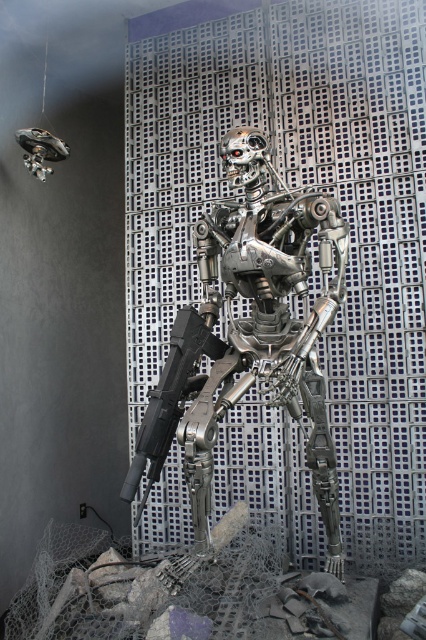
Question: Observing the image, what is the correct spatial positioning of metallic robot at center in reference to black matte gun at center?

Choices:
 (A) above
 (B) below

Answer: (A)

Question: Among these points, which one is nearest to the camera?

Choices:
 (A) (336, 291)
 (B) (149, 454)

Answer: (B)

Question: Does metallic robot at center appear over black matte gun at center?

Choices:
 (A) yes
 (B) no

Answer: (A)

Question: Does metallic robot at center have a greater width compared to black matte gun at center?

Choices:
 (A) no
 (B) yes

Answer: (B)

Question: Which point is closer to the camera?

Choices:
 (A) (183, 310)
 (B) (198, 522)

Answer: (A)

Question: Which point is farther to the camera?

Choices:
 (A) (267, 316)
 (B) (189, 333)

Answer: (A)